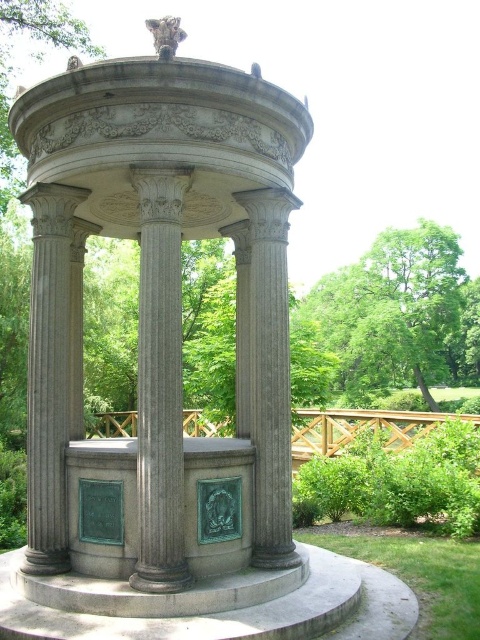
Is gray stone gazebo at center shorter than gray stone column at left?

Yes.

Can you confirm if gray stone gazebo at center is positioned below gray stone column at left?

No, gray stone gazebo at center is not below gray stone column at left.

The width and height of the screenshot is (480, 640). Identify the location of gray stone gazebo at center. [158, 317].

Is green leafy tree at upper right to the left of gray stone column at left from the viewer's perspective?

Incorrect, green leafy tree at upper right is not on the left side of gray stone column at left.

Who is positioned more to the left, green leafy tree at upper right or gray stone column at left?

gray stone column at left

The width and height of the screenshot is (480, 640). In order to click on green leafy tree at upper right in this screenshot , I will do `click(397, 314)`.

Between gray marble column at center and gray stone column at center, which one has less height?

gray stone column at center

Is gray marble column at center positioned before gray stone column at center?

Yes, gray marble column at center is in front of gray stone column at center.

Is point (154, 369) closer to camera compared to point (257, 456)?

Yes.

This screenshot has height=640, width=480. What are the coordinates of `gray marble column at center` in the screenshot? It's located at (159, 381).